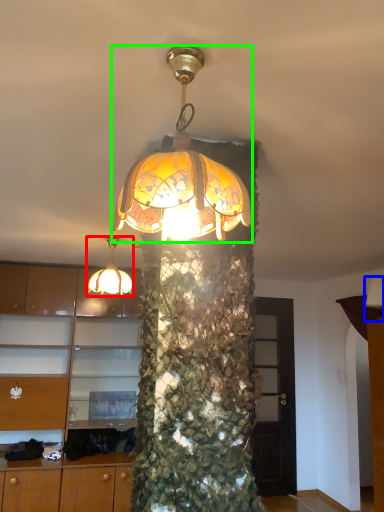
Question: Which object is the farthest from lamp (highlighted by a red box)? Choose among these: lamp (highlighted by a blue box) or lamp (highlighted by a green box).

Choices:
 (A) lamp
 (B) lamp

Answer: (A)